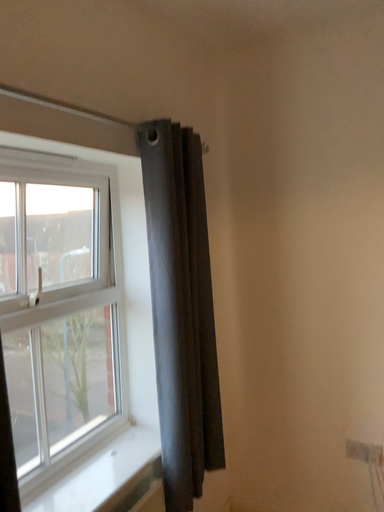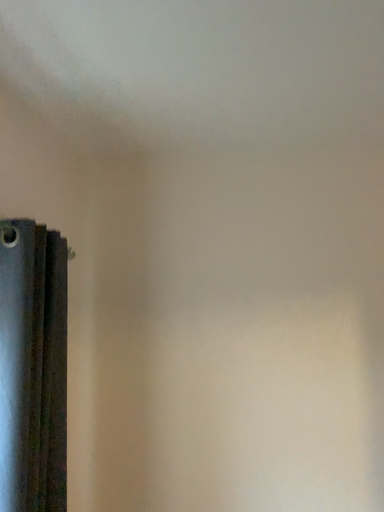
Question: How did the camera likely rotate when shooting the video?

Choices:
 (A) rotated left
 (B) rotated right

Answer: (B)